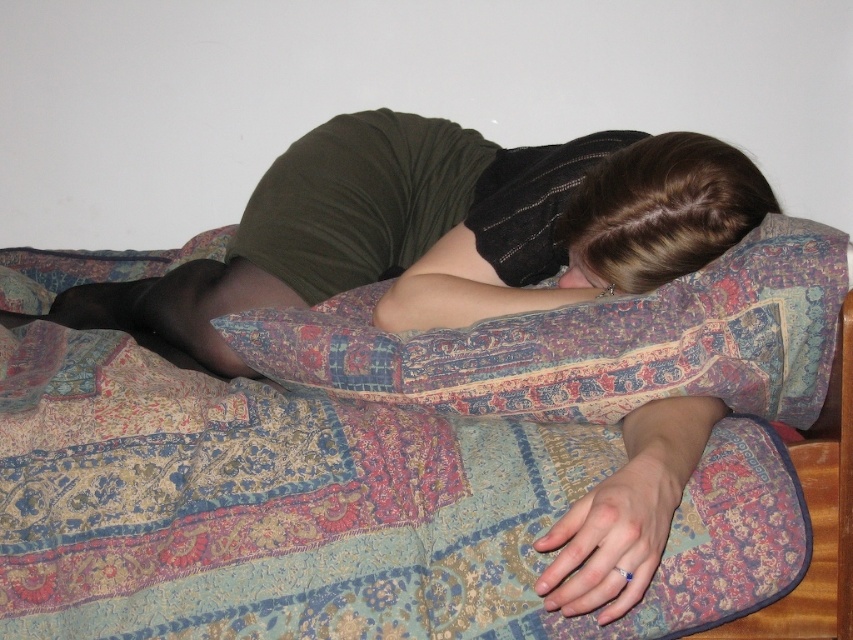
Question: Can you confirm if patterned fabric blanket at center is positioned to the left of matte green shirt at center?

Choices:
 (A) yes
 (B) no

Answer: (B)

Question: Which point is closer to the camera?

Choices:
 (A) (631, 192)
 (B) (506, 292)

Answer: (A)

Question: Which point is closer to the camera?

Choices:
 (A) patterned fabric blanket at center
 (B) matte green shirt at center
 (C) brown hair at upper center

Answer: (A)

Question: Among these objects, which one is nearest to the camera?

Choices:
 (A) matte green shirt at center
 (B) patterned fabric blanket at center
 (C) brown hair at upper center

Answer: (B)

Question: From the image, what is the correct spatial relationship of patterned fabric blanket at center in relation to brown hair at upper center?

Choices:
 (A) right
 (B) left

Answer: (B)

Question: In this image, where is patterned fabric blanket at center located relative to matte green shirt at center?

Choices:
 (A) below
 (B) above

Answer: (A)